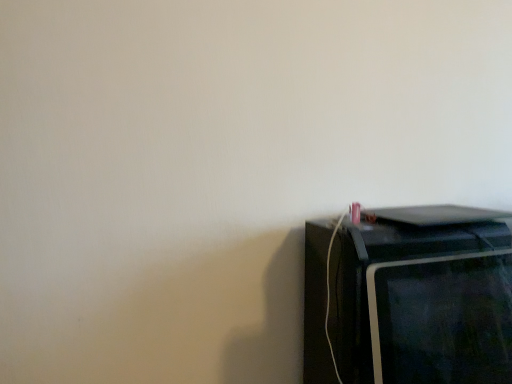
This screenshot has width=512, height=384. What do you see at coordinates (409, 297) in the screenshot?
I see `black glossy microwave at right` at bounding box center [409, 297].

In order to face black glossy microwave at right, should I rotate leftwards or rightwards?

A 19.445 degree turn to the right will do.

The height and width of the screenshot is (384, 512). I want to click on black glossy microwave at right, so click(x=409, y=297).

What do you see at coordinates (442, 319) in the screenshot?
I see `black glossy monitor at lower right` at bounding box center [442, 319].

Identify the location of black glossy monitor at lower right. (442, 319).

I want to click on black glossy microwave at right, so click(409, 297).

Can you confirm if black glossy microwave at right is positioned to the right of black glossy monitor at lower right?

Incorrect, black glossy microwave at right is not on the right side of black glossy monitor at lower right.

Between black glossy microwave at right and black glossy monitor at lower right, which one is positioned in front?

black glossy monitor at lower right is closer to the camera.

Considering the points (360, 330) and (411, 316), which point is behind, point (360, 330) or point (411, 316)?

Point (360, 330)

From the image's perspective, is black glossy microwave at right located above black glossy monitor at lower right?

No, from the image's perspective, black glossy microwave at right is not over black glossy monitor at lower right.

From a real-world perspective, is black glossy microwave at right located higher than black glossy monitor at lower right?

Incorrect, from a real-world perspective, black glossy microwave at right is lower than black glossy monitor at lower right.

Can you confirm if black glossy microwave at right is thinner than black glossy monitor at lower right?

No.

Who is shorter, black glossy microwave at right or black glossy monitor at lower right?

With less height is black glossy monitor at lower right.

Who is bigger, black glossy microwave at right or black glossy monitor at lower right?

With larger size is black glossy microwave at right.

Is black glossy monitor at lower right surrounded by black glossy microwave at right?

No.

Is there a large distance between black glossy microwave at right and black glossy monitor at lower right?

No.

Is black glossy microwave at right aimed at black glossy monitor at lower right?

Yes, black glossy microwave at right is turned towards black glossy monitor at lower right.

I want to click on computer monitor in front of the black glossy microwave at right, so click(x=442, y=319).

Which is more to the left, black glossy monitor at lower right or black glossy microwave at right?

black glossy microwave at right.

Is black glossy monitor at lower right closer to the viewer compared to black glossy microwave at right?

Yes, black glossy monitor at lower right is in front of black glossy microwave at right.

Is point (453, 341) less distant than point (314, 323)?

That is True.

From the image's perspective, is black glossy monitor at lower right below black glossy microwave at right?

No, from the image's perspective, black glossy monitor at lower right is not below black glossy microwave at right.

From a real-world perspective, is black glossy monitor at lower right physically above black glossy microwave at right?

Indeed, from a real-world perspective, black glossy monitor at lower right stands above black glossy microwave at right.

Considering the sizes of black glossy monitor at lower right and black glossy microwave at right in the image, is black glossy monitor at lower right wider or thinner than black glossy microwave at right?

Clearly, black glossy monitor at lower right has less width compared to black glossy microwave at right.

Which of these two, black glossy monitor at lower right or black glossy microwave at right, stands shorter?

black glossy monitor at lower right.

Can you confirm if black glossy monitor at lower right is bigger than black glossy microwave at right?

Actually, black glossy monitor at lower right might be smaller than black glossy microwave at right.

Would you say black glossy monitor at lower right is inside or outside black glossy microwave at right?

black glossy monitor at lower right exists outside the volume of black glossy microwave at right.

Consider the image. Is black glossy monitor at lower right not close to black glossy microwave at right?

No, black glossy monitor at lower right is in close proximity to black glossy microwave at right.

Does black glossy monitor at lower right turn towards black glossy microwave at right?

Yes, black glossy monitor at lower right is turned towards black glossy microwave at right.

The width and height of the screenshot is (512, 384). Find the location of `computer monitor above the black glossy microwave at right (from a real-world perspective)`. computer monitor above the black glossy microwave at right (from a real-world perspective) is located at coordinates (442, 319).

What are the coordinates of `computer monitor that appears above the black glossy microwave at right (from the image's perspective)` in the screenshot? It's located at (442, 319).

The width and height of the screenshot is (512, 384). Identify the location of home appliance below the black glossy monitor at lower right (from a real-world perspective). (409, 297).